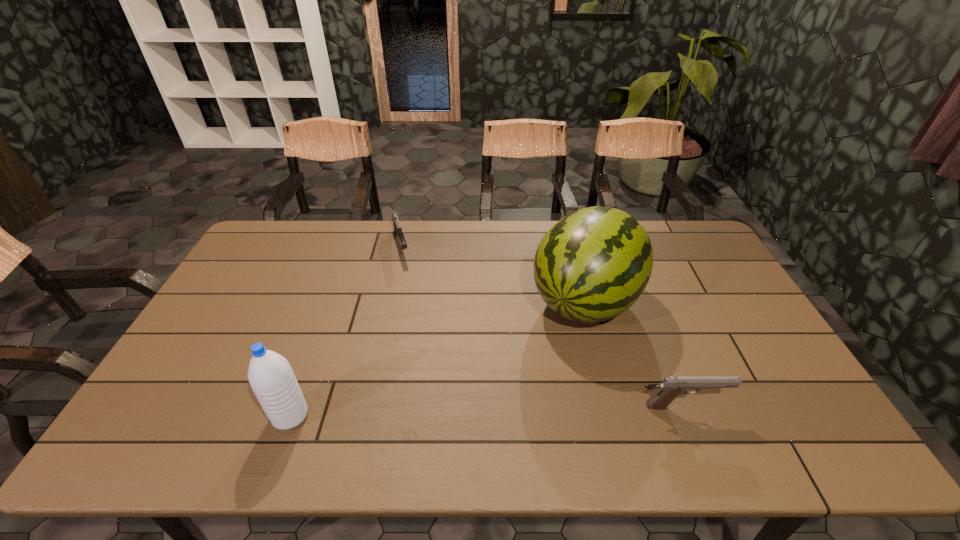
At what (x,y) coordinates should I click in order to perform the action: click on vacant space that's between the shortest object and the third tallest object. Please return your answer as a coordinate pair (x, y). The height and width of the screenshot is (540, 960). Looking at the image, I should click on tap(543, 326).

Identify the location of vacant area that lies between the water bottle and the second farthest object. This screenshot has height=540, width=960. (438, 359).

Locate an element on the screen. This screenshot has width=960, height=540. vacant area that lies between the water bottle and the second farthest object is located at coordinates (438, 359).

At what (x,y) coordinates should I click in order to perform the action: click on vacant area between the leftmost object and the watermelon. Please return your answer as a coordinate pair (x, y). The height and width of the screenshot is (540, 960). Looking at the image, I should click on (438, 359).

At what (x,y) coordinates should I click in order to perform the action: click on unoccupied area between the water bottle and the pistol. Please return your answer as a coordinate pair (x, y). Looking at the image, I should click on [x=488, y=411].

Identify which object is the third nearest to the second shortest object. Please provide its 2D coordinates. Your answer should be formatted as a tuple, i.e. [(x, y)], where the tuple contains the x and y coordinates of a point satisfying the conditions above.

[(397, 228)]

This screenshot has height=540, width=960. In order to click on object that can be found as the closest to the third nearest object in this screenshot , I will do `click(672, 386)`.

Locate an element on the screen. The image size is (960, 540). free location that satisfies the following two spatial constraints: 1. on the back side of the farthest object; 2. on the right side of the water bottle is located at coordinates (352, 245).

Identify the location of free space that satisfies the following two spatial constraints: 1. on the back side of the third tallest object; 2. at the barrel of the leftmost object. The width and height of the screenshot is (960, 540). (294, 407).

Where is `free space that satisfies the following two spatial constraints: 1. on the back side of the pistol; 2. at the barrel of the leftmost object`? free space that satisfies the following two spatial constraints: 1. on the back side of the pistol; 2. at the barrel of the leftmost object is located at coordinates (294, 407).